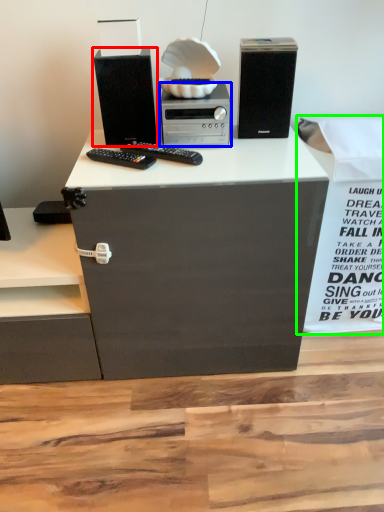
Question: Which is farther away from computer tower (highlighted by a red box)? home appliance (highlighted by a blue box) or cardboard box (highlighted by a green box)?

Choices:
 (A) home appliance
 (B) cardboard box

Answer: (B)